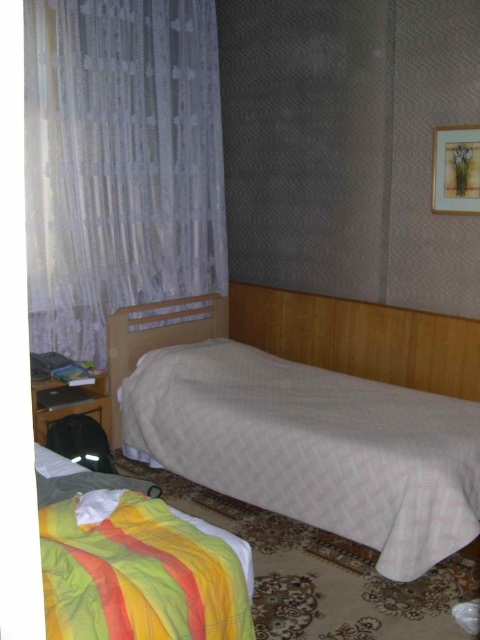
Is white woven bed at center taller than white sheer curtain at left?

In fact, white woven bed at center may be shorter than white sheer curtain at left.

Is white woven bed at center shorter than white sheer curtain at left?

Indeed, white woven bed at center has a lesser height compared to white sheer curtain at left.

Is point (453, 486) in front of point (110, 296)?

That is True.

I want to click on white woven bed at center, so click(314, 413).

Is white sheer curtain at left closer to camera compared to striped cotton blanket at lower left?

No, it is not.

Between white sheer curtain at left and striped cotton blanket at lower left, which one appears on the right side from the viewer's perspective?

striped cotton blanket at lower left

Identify the location of white sheer curtain at left. The height and width of the screenshot is (640, 480). (120, 163).

Can you confirm if white woven bed at center is positioned above striped cotton blanket at lower left?

Yes, white woven bed at center is above striped cotton blanket at lower left.

Locate an element on the screen. The height and width of the screenshot is (640, 480). white woven bed at center is located at coordinates (314, 413).